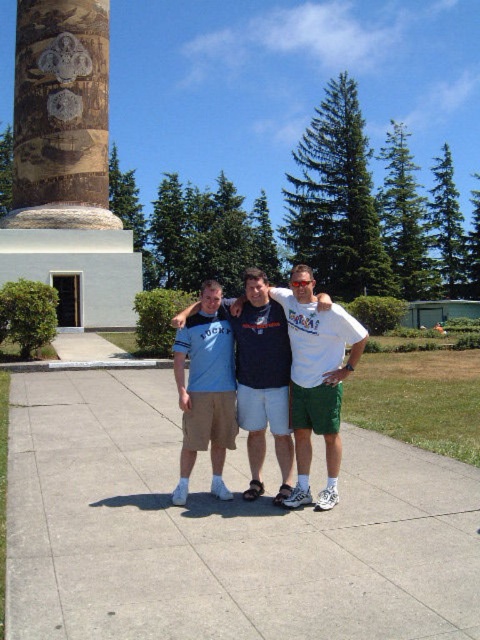
Between brown textured column at upper left and matte blue t-shirt at center, which one appears on the left side from the viewer's perspective?

From the viewer's perspective, brown textured column at upper left appears more on the left side.

Can you confirm if brown textured column at upper left is shorter than matte blue t-shirt at center?

No, brown textured column at upper left is not shorter than matte blue t-shirt at center.

Who is more forward, (49, 179) or (277, 388)?

Positioned in front is point (277, 388).

This screenshot has height=640, width=480. In order to click on brown textured column at upper left in this screenshot , I will do coord(67,168).

Which is more to the right, concrete at center or brown textured column at upper left?

concrete at center

Is concrete at center shorter than brown textured column at upper left?

Correct, concrete at center is not as tall as brown textured column at upper left.

Between point (51, 387) and point (122, 276), which one is positioned behind?

The point (122, 276) is behind.

Find the location of a particular element. concrete at center is located at coordinates (220, 531).

In the scene shown: Can you confirm if concrete at center is wider than dark blue t-shirt at center?

Yes.

Locate an element on the screen. concrete at center is located at coordinates (220, 531).

What are the coordinates of `concrete at center` in the screenshot? It's located at (220, 531).